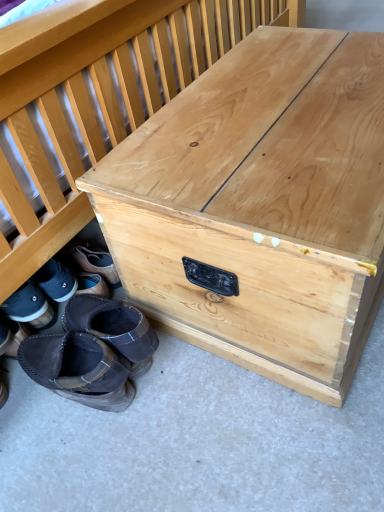
This screenshot has width=384, height=512. What do you see at coordinates (114, 328) in the screenshot?
I see `dark brown suede moccasin at lower left, the fifth footwear in the left-to-right sequence` at bounding box center [114, 328].

You are a GUI agent. You are given a task and a screenshot of the screen. Output one action in this format:
    pyautogui.click(x=<x>, y=<y>)
    Task: Click on the black suede boot at lower left, marked as the fourth footwear in a right-to-left arrangement
    The image size is (384, 512).
    Given the screenshot: What is the action you would take?
    (x=29, y=306)

The height and width of the screenshot is (512, 384). I want to click on natural wood trunk at center, so click(260, 207).

What do you see at coordinates (78, 369) in the screenshot? I see `brown suede boot at lower left, the fourth footwear in the left-to-right sequence` at bounding box center [78, 369].

The width and height of the screenshot is (384, 512). Find the location of `brown suede boot at lower left, the 1th footwear from the left`. brown suede boot at lower left, the 1th footwear from the left is located at coordinates (14, 337).

In terms of width, does brown suede boot at lower left, the 1th footwear from the left, look wider or thinner when compared to black suede boot at lower left, the second footwear in the left-to-right sequence?

In the image, brown suede boot at lower left, the 1th footwear from the left, appears to be more narrow than black suede boot at lower left, the second footwear in the left-to-right sequence.

From the image's perspective, which is below, brown suede boot at lower left, the 1th footwear from the left, or black suede boot at lower left, the second footwear in the left-to-right sequence?

brown suede boot at lower left, the 1th footwear from the left.

Looking at this image, considering the sizes of brown suede boot at lower left, the 1th footwear from the left, and black suede boot at lower left, the second footwear in the left-to-right sequence, in the image, is brown suede boot at lower left, the 1th footwear from the left, taller or shorter than black suede boot at lower left, the second footwear in the left-to-right sequence,?

Clearly, brown suede boot at lower left, the 1th footwear from the left, is taller compared to black suede boot at lower left, the second footwear in the left-to-right sequence.

Is point (14, 330) less distant than point (33, 294)?

No, it is behind (33, 294).

Is dark brown suede moccasin at lower left, which appears as the first footwear when viewed from the right, not within brown suede boot at lower left, acting as the 5th footwear starting from the right?

dark brown suede moccasin at lower left, which appears as the first footwear when viewed from the right, lies outside brown suede boot at lower left, acting as the 5th footwear starting from the right,'s area.

Does dark brown suede moccasin at lower left, which appears as the first footwear when viewed from the right, have a greater width compared to brown suede boot at lower left, the 1th footwear from the left?

Indeed, dark brown suede moccasin at lower left, which appears as the first footwear when viewed from the right, has a greater width compared to brown suede boot at lower left, the 1th footwear from the left.

Is point (144, 321) closer to viewer compared to point (12, 338)?

That is True.

Is point (109, 392) less distant than point (22, 335)?

Yes, point (109, 392) is in front of point (22, 335).

Are leather boots at lower left, positioned as the third footwear in right-to-left order, and brown suede boot at lower left, acting as the 5th footwear starting from the right, making contact?

No, leather boots at lower left, positioned as the third footwear in right-to-left order, is not touching brown suede boot at lower left, acting as the 5th footwear starting from the right.

Could you tell me if leather boots at lower left, which is counted as the third footwear, starting from the left, is turned towards brown suede boot at lower left, acting as the 5th footwear starting from the right?

Yes.

Is leather boots at lower left, which is counted as the third footwear, starting from the left, facing towards natural wood trunk at center?

No, leather boots at lower left, which is counted as the third footwear, starting from the left, is not aimed at natural wood trunk at center.

What's the angular difference between leather boots at lower left, which is counted as the third footwear, starting from the left, and natural wood trunk at center's facing directions?

leather boots at lower left, which is counted as the third footwear, starting from the left, and natural wood trunk at center are facing 179 degrees away from each other.

In the scene shown: In terms of size, does leather boots at lower left, positioned as the third footwear in right-to-left order, appear bigger or smaller than natural wood trunk at center?

In the image, leather boots at lower left, positioned as the third footwear in right-to-left order, appears to be smaller than natural wood trunk at center.

Is leather boots at lower left, which is counted as the third footwear, starting from the left, in contact with natural wood trunk at center?

leather boots at lower left, which is counted as the third footwear, starting from the left, and natural wood trunk at center are clearly separated.

Is brown suede boot at lower left, acting as the 5th footwear starting from the right, directly adjacent to natural wood trunk at center?

No, brown suede boot at lower left, acting as the 5th footwear starting from the right, is not with natural wood trunk at center.

Where is `the 5th footwear counting from the left of the natural wood trunk at center`? the 5th footwear counting from the left of the natural wood trunk at center is located at coordinates (14, 337).

Which is behind, point (8, 348) or point (218, 239)?

The point (8, 348) is more distant.

Does point (6, 300) appear closer or farther from the camera than point (99, 397)?

Point (6, 300) appears to be farther away from the viewer than point (99, 397).

From a real-world perspective, is black suede boot at lower left, the second footwear in the left-to-right sequence, on top of brown suede boot at lower left, the 2th footwear positioned from the right?

Yes, from a real-world perspective, black suede boot at lower left, the second footwear in the left-to-right sequence, is above brown suede boot at lower left, the 2th footwear positioned from the right.

Considering the relative sizes of black suede boot at lower left, marked as the fourth footwear in a right-to-left arrangement, and brown suede boot at lower left, the fourth footwear in the left-to-right sequence, in the image provided, is black suede boot at lower left, marked as the fourth footwear in a right-to-left arrangement, shorter than brown suede boot at lower left, the fourth footwear in the left-to-right sequence,?

In fact, black suede boot at lower left, marked as the fourth footwear in a right-to-left arrangement, may be taller than brown suede boot at lower left, the fourth footwear in the left-to-right sequence.

Does natural wood trunk at center have a larger size compared to brown suede boot at lower left, the fourth footwear in the left-to-right sequence?

Yes.

Is natural wood trunk at center looking in the opposite direction of brown suede boot at lower left, the fourth footwear in the left-to-right sequence?

No, natural wood trunk at center's orientation is not away from brown suede boot at lower left, the fourth footwear in the left-to-right sequence.

Looking at their sizes, would you say natural wood trunk at center is wider or thinner than brown suede boot at lower left, the fourth footwear in the left-to-right sequence?

Clearly, natural wood trunk at center has more width compared to brown suede boot at lower left, the fourth footwear in the left-to-right sequence.

Would you say natural wood trunk at center is inside or outside brown suede boot at lower left, the 2th footwear positioned from the right?

natural wood trunk at center lies outside brown suede boot at lower left, the 2th footwear positioned from the right.

There is a black suede boot at lower left, the second footwear in the left-to-right sequence. Identify the location of the 1st footwear below it (from the image's perspective). (14, 337).

Where is `the 1st footwear behind the brown suede boot at lower left, the 1th footwear from the left, counting from the anchor's position`? the 1st footwear behind the brown suede boot at lower left, the 1th footwear from the left, counting from the anchor's position is located at coordinates (114, 328).

Considering their positions, is leather boots at lower left, which is counted as the third footwear, starting from the left, positioned closer to natural wood trunk at center than brown suede boot at lower left, the 2th footwear positioned from the right?

leather boots at lower left, which is counted as the third footwear, starting from the left, lies closer to natural wood trunk at center than the other object.

When comparing their distances from natural wood trunk at center, does leather boots at lower left, positioned as the third footwear in right-to-left order, or dark brown suede moccasin at lower left, the fifth footwear in the left-to-right sequence, seem further?

The object further to natural wood trunk at center is dark brown suede moccasin at lower left, the fifth footwear in the left-to-right sequence.

Looking at this image, looking at the image, which one is located further to black suede boot at lower left, the second footwear in the left-to-right sequence, natural wood trunk at center or brown suede boot at lower left, the 2th footwear positioned from the right?

Among the two, natural wood trunk at center is located further to black suede boot at lower left, the second footwear in the left-to-right sequence.

Considering their positions, is leather boots at lower left, positioned as the third footwear in right-to-left order, positioned closer to natural wood trunk at center than black suede boot at lower left, marked as the fourth footwear in a right-to-left arrangement?

leather boots at lower left, positioned as the third footwear in right-to-left order, lies closer to natural wood trunk at center than the other object.

Considering their positions, is natural wood trunk at center positioned closer to black suede boot at lower left, marked as the fourth footwear in a right-to-left arrangement, than leather boots at lower left, which is counted as the third footwear, starting from the left?

Based on the image, leather boots at lower left, which is counted as the third footwear, starting from the left, appears to be nearer to black suede boot at lower left, marked as the fourth footwear in a right-to-left arrangement.

Estimate the real-world distances between objects in this image. Which object is closer to leather boots at lower left, which is counted as the third footwear, starting from the left, natural wood trunk at center or brown suede boot at lower left, the 1th footwear from the left?

Among the two, brown suede boot at lower left, the 1th footwear from the left, is located nearer to leather boots at lower left, which is counted as the third footwear, starting from the left.

From the image, which object appears to be nearer to natural wood trunk at center, dark brown suede moccasin at lower left, which appears as the first footwear when viewed from the right, or brown suede boot at lower left, the fourth footwear in the left-to-right sequence?

dark brown suede moccasin at lower left, which appears as the first footwear when viewed from the right, is positioned closer to the anchor natural wood trunk at center.

Considering their positions, is dark brown suede moccasin at lower left, the fifth footwear in the left-to-right sequence, positioned further to brown suede boot at lower left, the 2th footwear positioned from the right, than leather boots at lower left, positioned as the third footwear in right-to-left order?

dark brown suede moccasin at lower left, the fifth footwear in the left-to-right sequence, is positioned further to the anchor brown suede boot at lower left, the 2th footwear positioned from the right.

I want to click on footwear located between brown suede boot at lower left, the 1th footwear from the left, and leather boots at lower left, positioned as the third footwear in right-to-left order, in the left-right direction, so click(29, 306).

In order to click on footwear situated between black suede boot at lower left, the second footwear in the left-to-right sequence, and brown suede boot at lower left, the fourth footwear in the left-to-right sequence, from left to right in this screenshot , I will do `click(92, 353)`.

Identify the location of footwear between brown suede boot at lower left, the fourth footwear in the left-to-right sequence, and natural wood trunk at center. [114, 328].